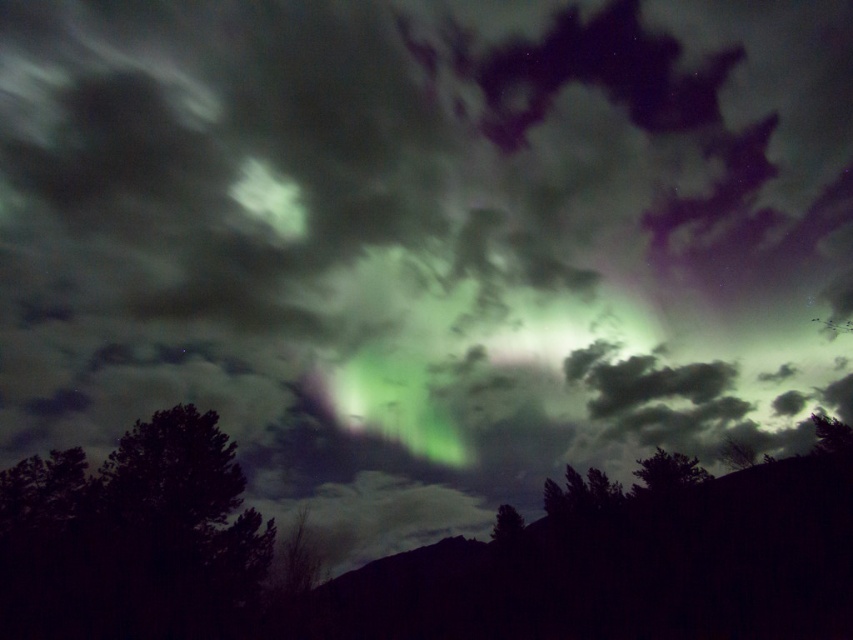
Question: Is green leafy tree at lower right to the right of green leafy tree at lower center from the viewer's perspective?

Choices:
 (A) no
 (B) yes

Answer: (B)

Question: Among these objects, which one is farthest from the camera?

Choices:
 (A) green leafy tree at lower right
 (B) dark green leafy tree at lower left

Answer: (A)

Question: Among these objects, which one is nearest to the camera?

Choices:
 (A) green leafy tree at lower center
 (B) green leafy tree at lower right
 (C) dark green leafy tree at lower left

Answer: (C)

Question: Which object appears closest to the camera in this image?

Choices:
 (A) dark green leafy tree at lower left
 (B) green leafy tree at lower center

Answer: (A)

Question: Does green leafy tree at lower right appear on the right side of green leafy tree at lower center?

Choices:
 (A) no
 (B) yes

Answer: (B)

Question: Is green leafy tree at lower right positioned before green leafy tree at lower center?

Choices:
 (A) yes
 (B) no

Answer: (A)